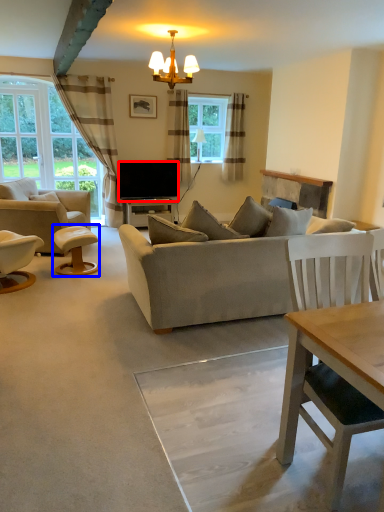
Question: Which object appears farthest to the camera in this image, television (highlighted by a red box) or stool (highlighted by a blue box)?

Choices:
 (A) television
 (B) stool

Answer: (A)